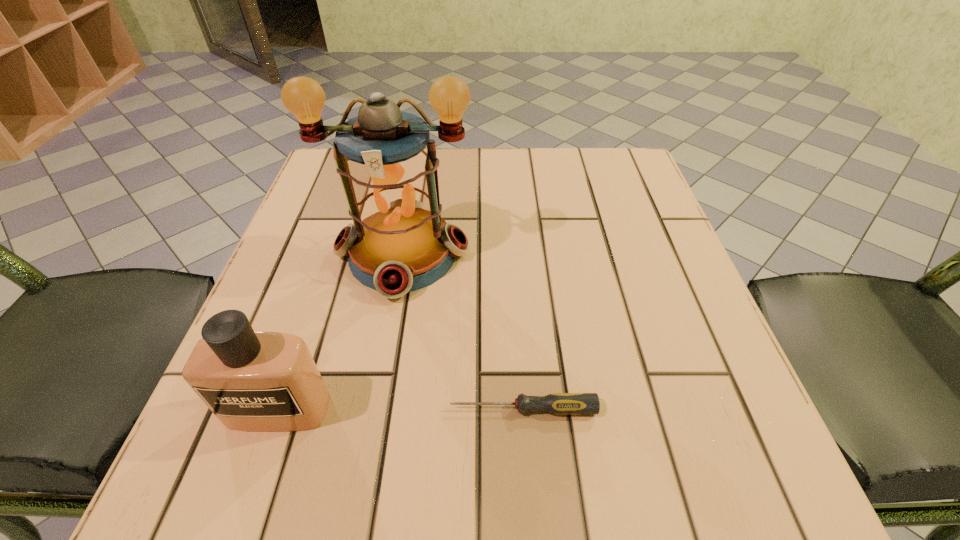
Identify which object is located as the second nearest to the farthest object. Please provide its 2D coordinates. Your answer should be formatted as a tuple, i.e. [(x, y)], where the tuple contains the x and y coordinates of a point satisfying the conditions above.

[(556, 403)]

Where is `vacant region that satisfies the following two spatial constraints: 1. insert the shortest object into a screw head; 2. on the front label of the perfume`? The width and height of the screenshot is (960, 540). vacant region that satisfies the following two spatial constraints: 1. insert the shortest object into a screw head; 2. on the front label of the perfume is located at coordinates (523, 409).

At what (x,y) coordinates should I click in order to perform the action: click on vacant space that satisfies the following two spatial constraints: 1. insert the screwdriver into a screw head; 2. on the front label of the perfume. Please return your answer as a coordinate pair (x, y). This screenshot has width=960, height=540. Looking at the image, I should click on (523, 409).